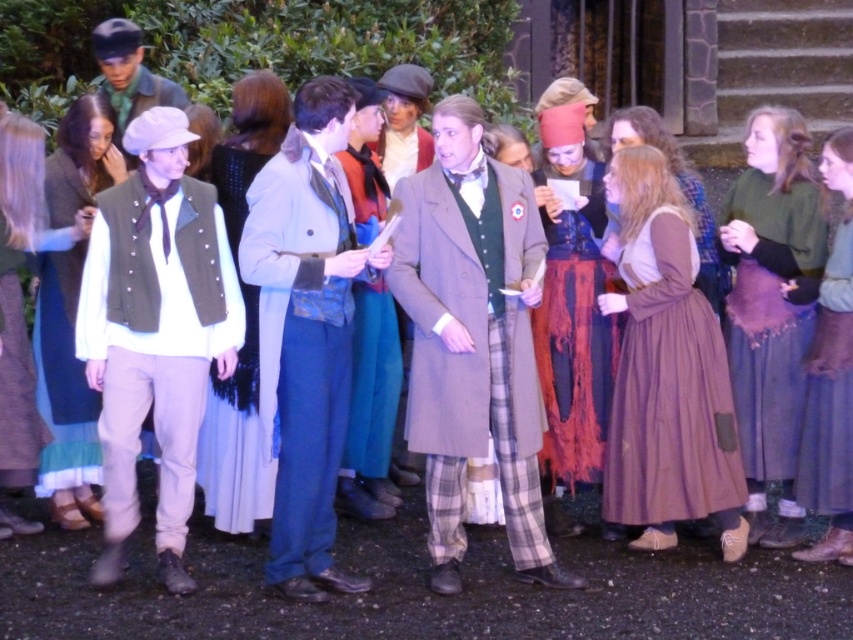
Question: Can you confirm if blue woolen dress at center is wider than brown woolen dress at center?

Choices:
 (A) no
 (B) yes

Answer: (A)

Question: Among these points, which one is farthest from the camera?

Choices:
 (A) (316, 449)
 (B) (13, 468)
 (C) (132, 33)

Answer: (C)

Question: Considering the relative positions of blue velvet dress at center and white woolen scarf at center in the image provided, where is blue velvet dress at center located with respect to white woolen scarf at center?

Choices:
 (A) above
 (B) below

Answer: (A)

Question: Among these points, which one is farthest from the camera?

Choices:
 (A) (849, 480)
 (B) (627, 413)
 (C) (618, 134)

Answer: (C)

Question: Does light gray wool coat at center have a lesser width compared to brown cotton dress at center?

Choices:
 (A) no
 (B) yes

Answer: (B)

Question: Which of the following is the farthest from the observer?

Choices:
 (A) (33, 369)
 (B) (850, 417)
 (C) (254, 484)
 (D) (292, 236)

Answer: (A)